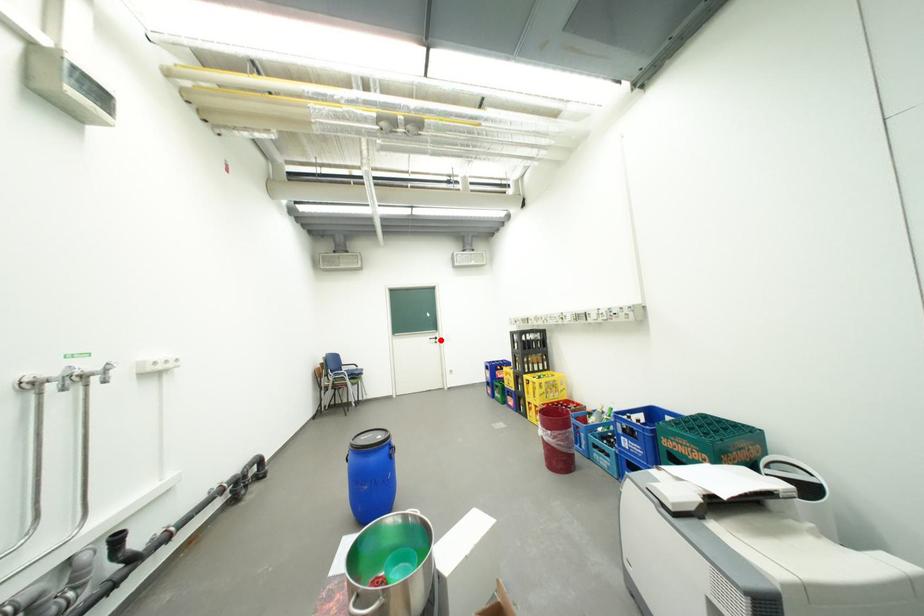
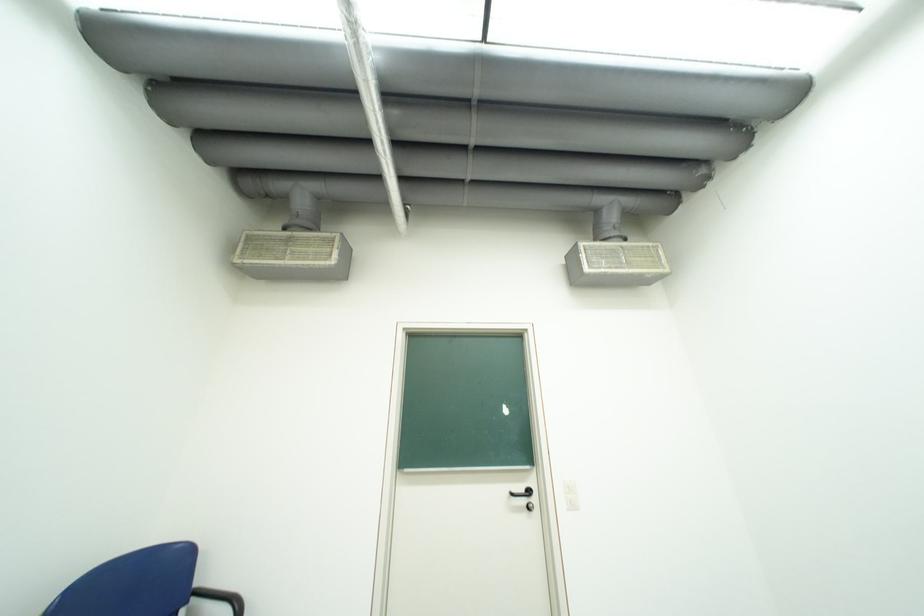
Where in the second image is the point corresponding to the highlighted location from the first image?

(523, 495)